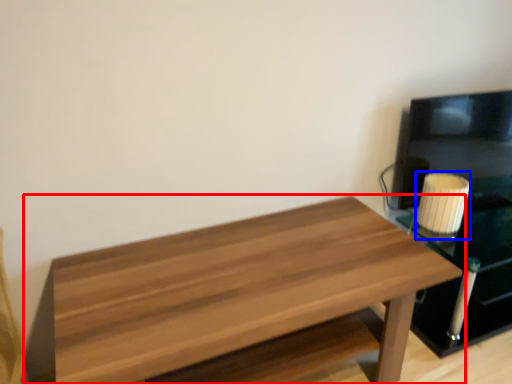
Question: Among these objects, which one is farthest to the camera, table (highlighted by a red box) or candle holder (highlighted by a blue box)?

Choices:
 (A) table
 (B) candle holder

Answer: (B)